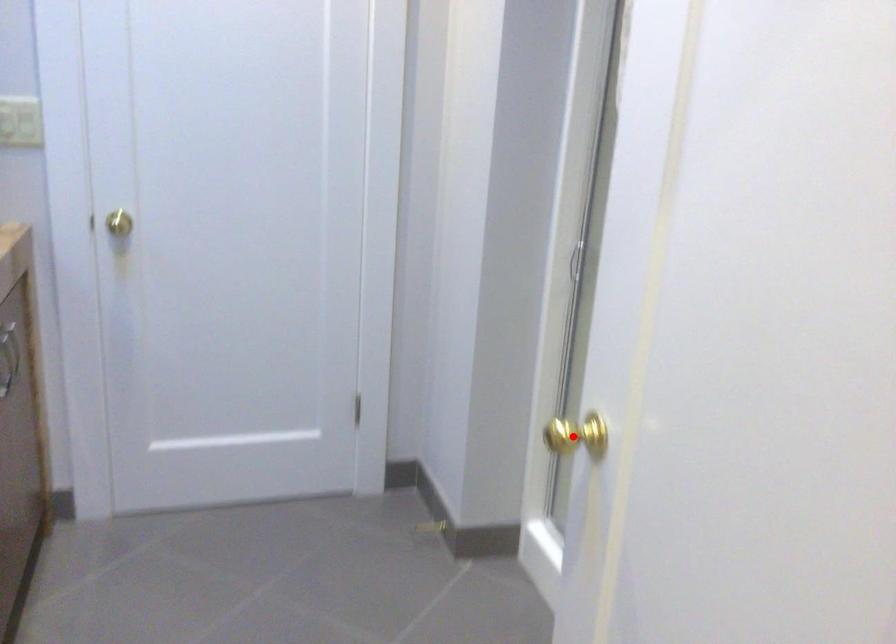
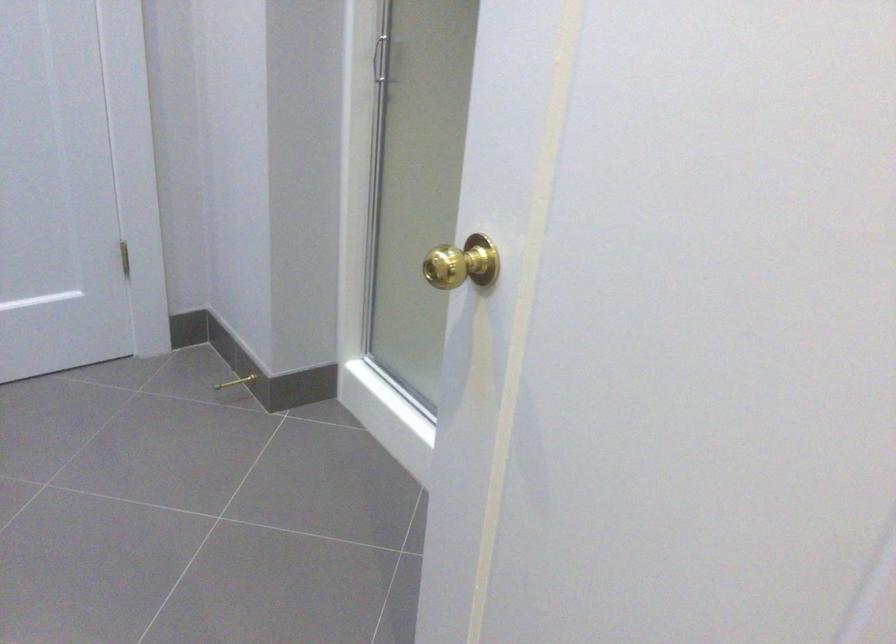
In the second image, find the point that corresponds to the highlighted location in the first image.

(461, 263)